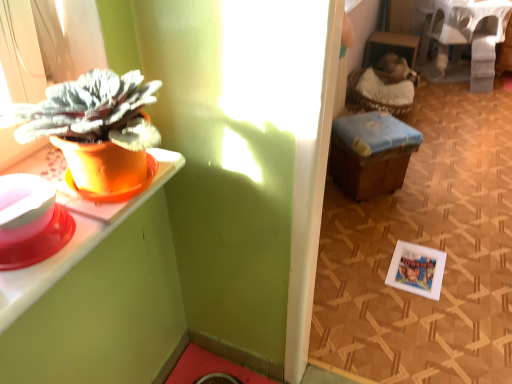
Locate an element on the screen. wooden stool at center is located at coordinates (371, 153).

Describe the element at coordinates (75, 241) in the screenshot. I see `orange matte pot at left` at that location.

I want to click on wooden stool at center, so click(x=371, y=153).

Can you confirm if wooden stool at center is thinner than white matte picture frame at lower right?

In fact, wooden stool at center might be wider than white matte picture frame at lower right.

Can you confirm if wooden stool at center is bigger than white matte picture frame at lower right?

Correct, wooden stool at center is larger in size than white matte picture frame at lower right.

Is wooden stool at center to the right of white matte picture frame at lower right from the viewer's perspective?

No, wooden stool at center is not to the right of white matte picture frame at lower right.

In the scene shown: Do you think wooden stool at center is within white matte picture frame at lower right, or outside of it?

The correct answer is: outside.

Is point (447, 44) positioned before point (169, 177)?

No.

Considering the relative positions of white fabric-covered table at upper right and orange matte pot at left in the image provided, is white fabric-covered table at upper right in front of orange matte pot at left?

No, white fabric-covered table at upper right is further to the viewer.

Are white fabric-covered table at upper right and orange matte pot at left located far from each other?

Yes, white fabric-covered table at upper right and orange matte pot at left are located far from each other.

From a real-world perspective, between white fabric-covered table at upper right and orange matte pot at left, who is vertically lower?

In real-world perspective, white fabric-covered table at upper right is lower.

Can you confirm if orange matte pot at left is bigger than white fabric-covered table at upper right?

No.

From the image's perspective, which object appears higher, orange matte pot at left or white fabric-covered table at upper right?

white fabric-covered table at upper right.

Can white fabric-covered table at upper right be found inside orange matte pot at left?

That's incorrect, white fabric-covered table at upper right is not inside orange matte pot at left.

Would you say orange matte pot at left is outside white matte picture frame at lower right?

orange matte pot at left is positioned outside white matte picture frame at lower right.

Which is in front, orange matte pot at left or white matte picture frame at lower right?

orange matte pot at left is in front.

How distant is orange matte pot at left from white matte picture frame at lower right?

orange matte pot at left and white matte picture frame at lower right are 1.27 meters apart.

Is point (5, 289) farther from viewer compared to point (434, 291)?

No.

Which object is positioned more to the right, wooden stool at center or orange matte pot at left?

wooden stool at center is more to the right.

Where is `stool lying on the right of orange matte pot at left`? stool lying on the right of orange matte pot at left is located at coordinates (371, 153).

Does wooden stool at center have a larger size compared to orange matte pot at left?

Yes, wooden stool at center is bigger than orange matte pot at left.

From the image's perspective, which object appears higher, wooden stool at center or orange matte pot at left?

wooden stool at center.

Can you tell me how much orange matte pot at left and wooden stool at center differ in facing direction?

The angle between the facing direction of orange matte pot at left and the facing direction of wooden stool at center is 4.01 degrees.

Is orange matte pot at left oriented towards wooden stool at center?

No.

From a real-world perspective, is orange matte pot at left physically located above or below wooden stool at center?

Clearly, from a real-world perspective, orange matte pot at left is above wooden stool at center.

Can you confirm if orange matte pot at left is shorter than wooden stool at center?

Yes.

Which object is positioned more to the left, wooden stool at center or white fabric-covered table at upper right?

wooden stool at center.

Is wooden stool at center next to white fabric-covered table at upper right and touching it?

wooden stool at center and white fabric-covered table at upper right are not in contact.

Is point (411, 145) farther from camera compared to point (504, 37)?

No, (411, 145) is in front of (504, 37).

The height and width of the screenshot is (384, 512). I want to click on stool that appears above the white matte picture frame at lower right (from a real-world perspective), so click(x=371, y=153).

The height and width of the screenshot is (384, 512). Find the location of `table located behind the orange matte pot at left`. table located behind the orange matte pot at left is located at coordinates (468, 36).

Which object lies further to the anchor point white matte picture frame at lower right, white fabric-covered table at upper right or wooden stool at center?

The object further to white matte picture frame at lower right is white fabric-covered table at upper right.

From the image, which object appears to be farther from orange matte pot at left, wooden stool at center or white matte picture frame at lower right?

wooden stool at center.

Considering their positions, is white matte picture frame at lower right positioned further to wooden stool at center than white fabric-covered table at upper right?

Among the two, white fabric-covered table at upper right is located further to wooden stool at center.

Looking at the image, which one is located further to wooden stool at center, orange matte pot at left or white fabric-covered table at upper right?

Based on the image, white fabric-covered table at upper right appears to be further to wooden stool at center.

Based on the photo, from the image, which object appears to be nearer to wooden stool at center, orange matte pot at left or white matte picture frame at lower right?

Among the two, white matte picture frame at lower right is located nearer to wooden stool at center.

From the image, which object appears to be nearer to orange matte pot at left, white matte picture frame at lower right or white fabric-covered table at upper right?

white matte picture frame at lower right is positioned closer to the anchor orange matte pot at left.

From the image, which object appears to be farther from wooden stool at center, white fabric-covered table at upper right or white matte picture frame at lower right?

white fabric-covered table at upper right is positioned further to the anchor wooden stool at center.

Looking at the image, which one is located further to white matte picture frame at lower right, wooden stool at center or orange matte pot at left?

orange matte pot at left is further to white matte picture frame at lower right.

I want to click on stool between white fabric-covered table at upper right and white matte picture frame at lower right in the up-down direction, so click(371, 153).

Locate an element on the screen. Image resolution: width=512 pixels, height=384 pixels. stool between orange matte pot at left and white fabric-covered table at upper right from front to back is located at coordinates (371, 153).

At what (x,y) coordinates should I click in order to perform the action: click on picture frame between orange matte pot at left and wooden stool at center along the z-axis. Please return your answer as a coordinate pair (x, y). Image resolution: width=512 pixels, height=384 pixels. Looking at the image, I should click on (417, 269).

Identify the location of picture frame located between orange matte pot at left and white fabric-covered table at upper right in the depth direction. (417, 269).